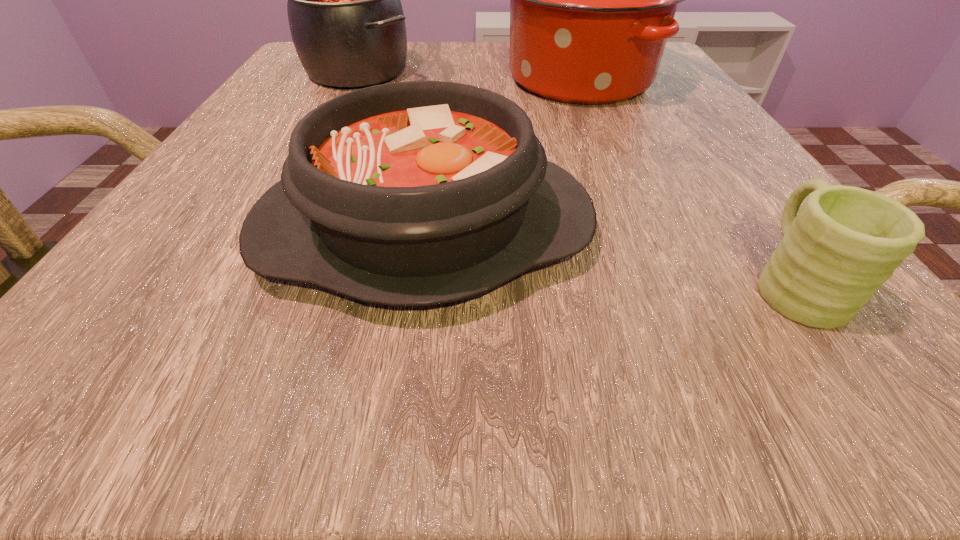
Where is `the tallest object`? the tallest object is located at coordinates (592, 0).

At what (x,y) coordinates should I click in order to perform the action: click on the nearest casserole. Please return your answer as a coordinate pair (x, y). Looking at the image, I should click on tap(416, 193).

At what (x,y) coordinates should I click in order to perform the action: click on mug. Please return your answer as a coordinate pair (x, y). The height and width of the screenshot is (540, 960). Looking at the image, I should click on (845, 242).

You are a GUI agent. You are given a task and a screenshot of the screen. Output one action in this format:
    pyautogui.click(x=<x>, y=<y>)
    Task: Click on the vacant area situated 0.210m on the left of the tallest object
    The image size is (960, 540).
    Given the screenshot: What is the action you would take?
    pyautogui.click(x=388, y=78)

You are a GUI agent. You are given a task and a screenshot of the screen. Output one action in this format:
    pyautogui.click(x=<x>, y=<y>)
    Task: Click on the vacant space situated 0.130m on the right of the nearest casserole
    The image size is (960, 540).
    Given the screenshot: What is the action you would take?
    pyautogui.click(x=702, y=231)

Identify the location of vacant space located 0.240m on the side of the shortest object with the handle. (693, 140).

This screenshot has height=540, width=960. Identify the location of free spot located on the side of the shortest object with the handle. (715, 172).

You are a GUI agent. You are given a task and a screenshot of the screen. Output one action in this format:
    pyautogui.click(x=<x>, y=<y>)
    Task: Click on the vacant space located 0.170m on the side of the shortest object with the handle
    This screenshot has width=960, height=540.
    Given the screenshot: What is the action you would take?
    pyautogui.click(x=710, y=164)

Locate an element on the screen. casserole at the near edge is located at coordinates point(416,193).

At what (x,y) coordinates should I click in order to perform the action: click on mug that is at the near edge. Please return your answer as a coordinate pair (x, y). Image resolution: width=960 pixels, height=540 pixels. Looking at the image, I should click on (845, 242).